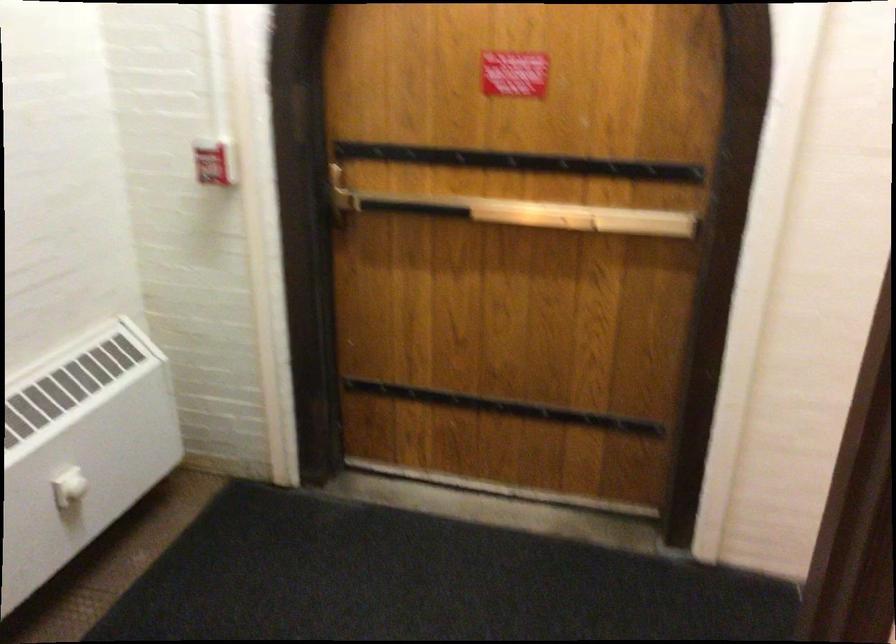
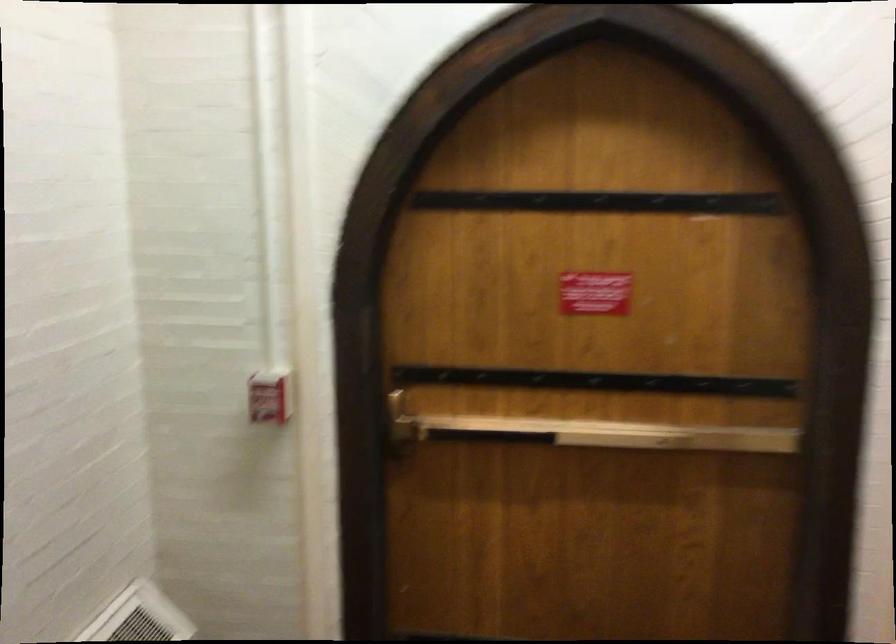
The point at (496, 210) is marked in the first image. Where is the corresponding point in the second image?

(595, 433)